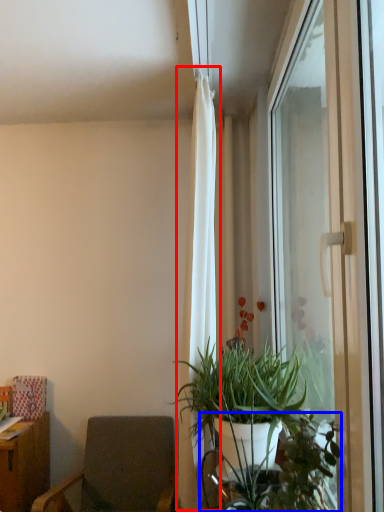
Question: Which point is closer to the camera, curtain (highlighted by a red box) or vegetation (highlighted by a blue box)?

Choices:
 (A) curtain
 (B) vegetation

Answer: (B)